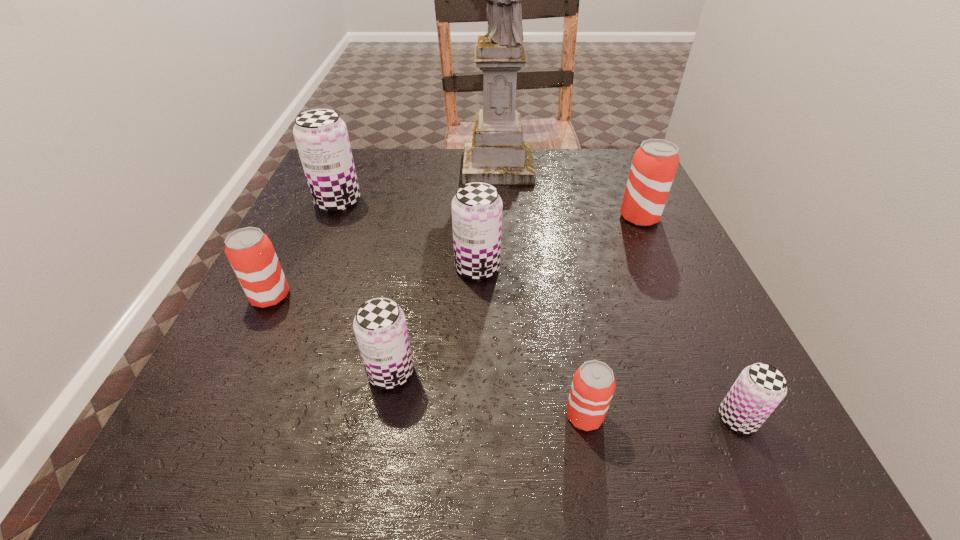
Where is `vacant space that is in between the rightmost orange beer can and the nearest orange beer can`? This screenshot has width=960, height=540. vacant space that is in between the rightmost orange beer can and the nearest orange beer can is located at coordinates (612, 316).

What are the coordinates of `vacant space in between the biggest orange beer can and the third purple beer can from right to left` in the screenshot? It's located at (516, 295).

This screenshot has height=540, width=960. Identify the location of free space between the nearest purple beer can and the leftmost orange beer can. (504, 357).

Identify the location of empty location between the second purple beer can from left to right and the second orange beer can from right to left. (488, 394).

Find the location of a particular element. vacant point located between the third biggest purple beer can and the second smallest orange beer can is located at coordinates (330, 334).

Identify the location of free space between the second tallest object and the nearest purple beer can. coord(538,310).

The width and height of the screenshot is (960, 540). What are the coordinates of `object that is the fifth closest one to the third nearest object` in the screenshot? It's located at [x=759, y=389].

Locate an element on the screen. Image resolution: width=960 pixels, height=540 pixels. object that is the fourth closest to the leftmost orange beer can is located at coordinates (497, 154).

Image resolution: width=960 pixels, height=540 pixels. I want to click on beer can that is the fourth closest to the leftmost purple beer can, so click(654, 165).

Identify which beer can is located as the sixth nearest to the farthest orange beer can. Please provide its 2D coordinates. Your answer should be formatted as a tuple, i.e. [(x, y)], where the tuple contains the x and y coordinates of a point satisfying the conditions above.

[(250, 252)]